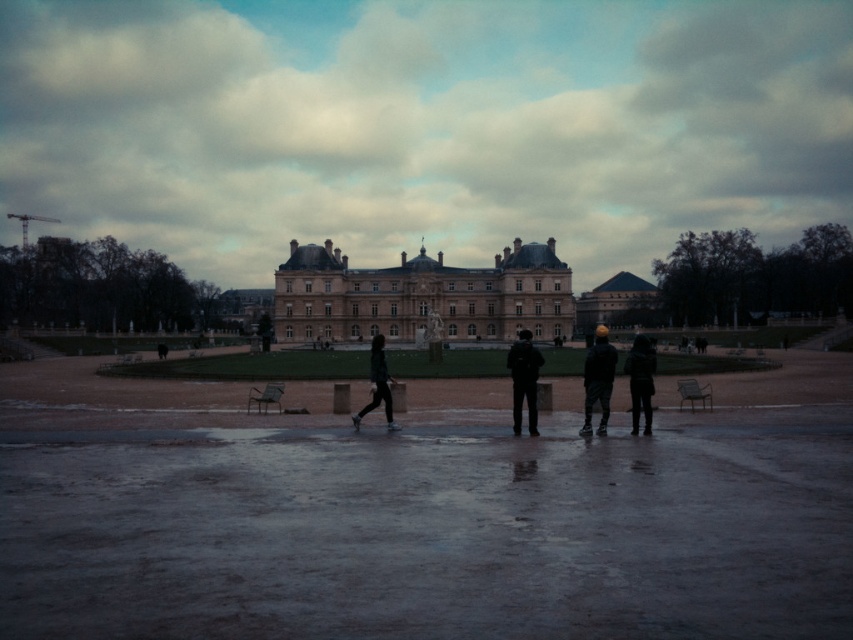
You are standing in the open area in front of the beige stone palace at center. You want to take a photo of the palace with your smartphone. Considering the distance, will you need to zoom in to capture the entire building in the frame?

The beige stone palace at center is 159.77 meters away from the viewer. At this distance, you will likely need to zoom in to ensure the entire palace fits within the smartphone camera frame.